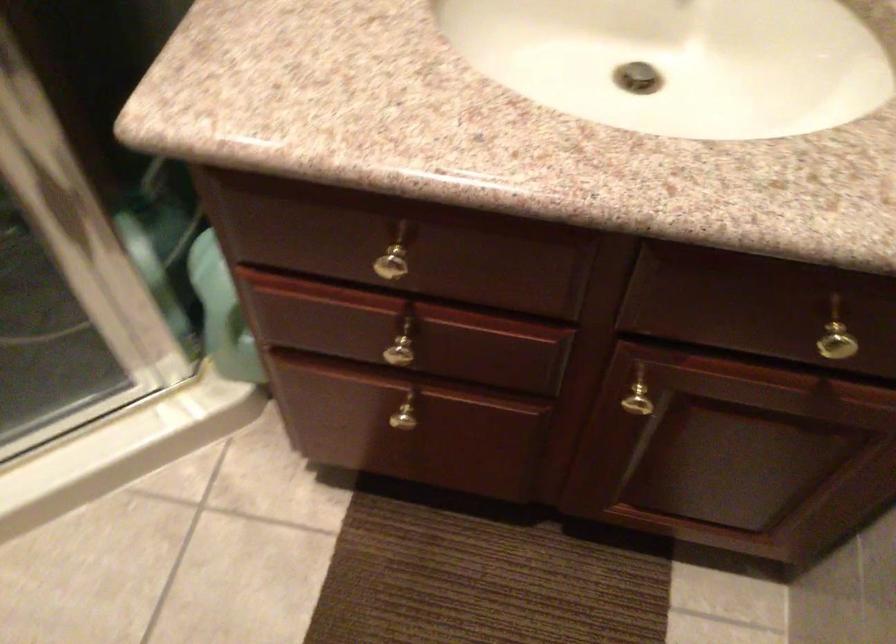
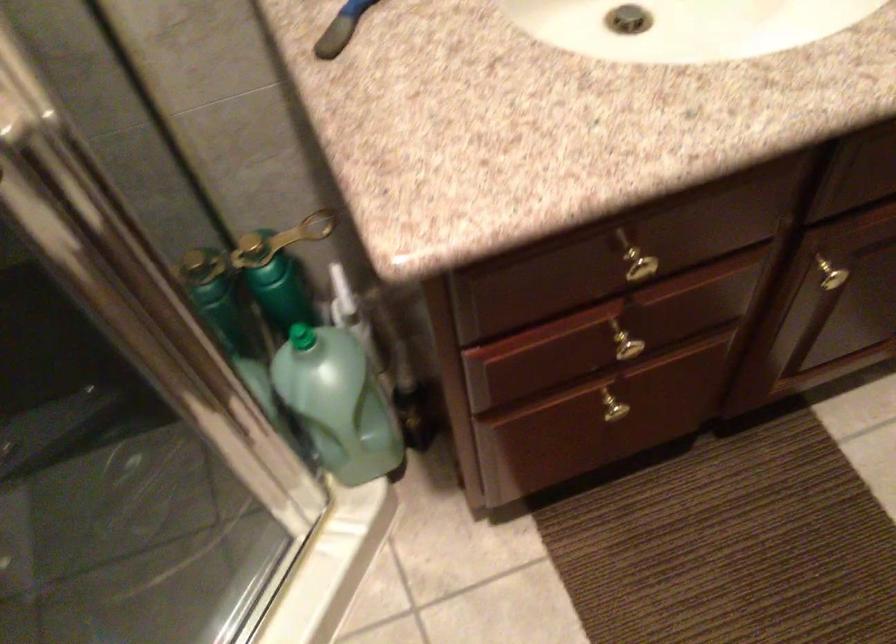
Locate, in the second image, the point that corresponds to point (399, 351) in the first image.

(625, 346)